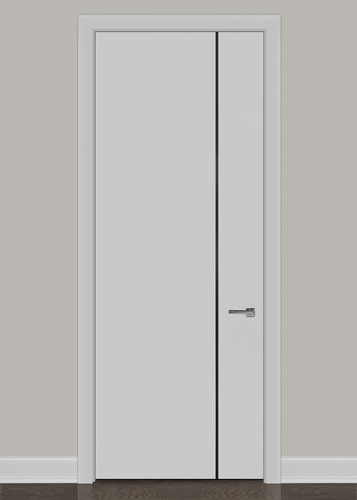
Image resolution: width=357 pixels, height=500 pixels. In order to click on left doorframe in this screenshot , I will do pos(86,345).